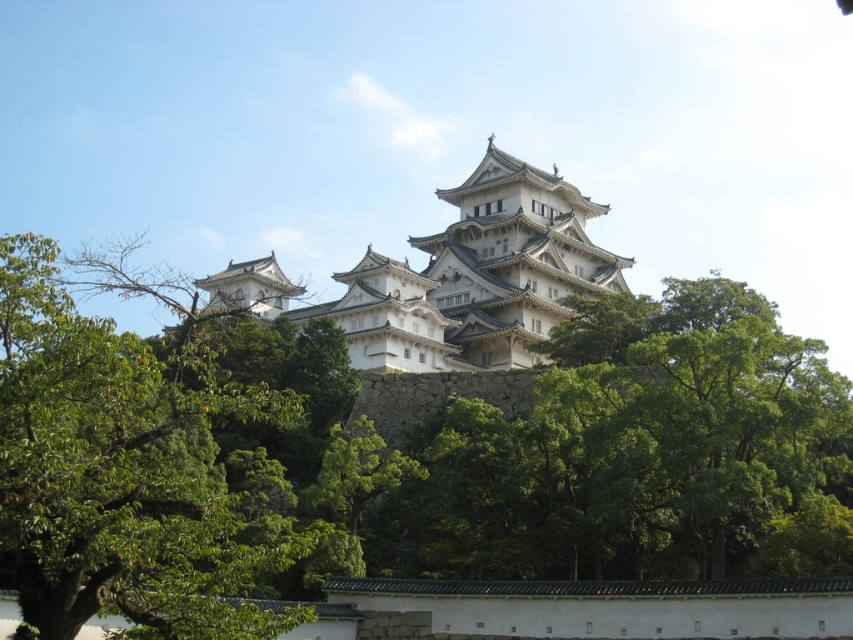
Does green leafy tree at center appear under green leafy tree at left?

Actually, green leafy tree at center is above green leafy tree at left.

Does green leafy tree at center come behind green leafy tree at left?

Yes.

Does point (434, 532) come closer to viewer compared to point (141, 634)?

No.

I want to click on green leafy tree at center, so click(x=636, y=452).

Between point (48, 291) and point (577, 189), which one is positioned in front?

Point (48, 291)

Is green leafy tree at left taller than white stone castle at center?

No.

Does point (47, 310) come in front of point (289, 291)?

Yes.

At what (x,y) coordinates should I click in order to perform the action: click on green leafy tree at left. Please return your answer as a coordinate pair (x, y). This screenshot has height=640, width=853. Looking at the image, I should click on (120, 468).

Is green leafy tree at center further to camera compared to white stone castle at center?

No, green leafy tree at center is closer to the viewer.

Can you confirm if green leafy tree at center is taller than white stone castle at center?

Incorrect, green leafy tree at center's height is not larger of white stone castle at center's.

This screenshot has height=640, width=853. What are the coordinates of `green leafy tree at center` in the screenshot? It's located at (636, 452).